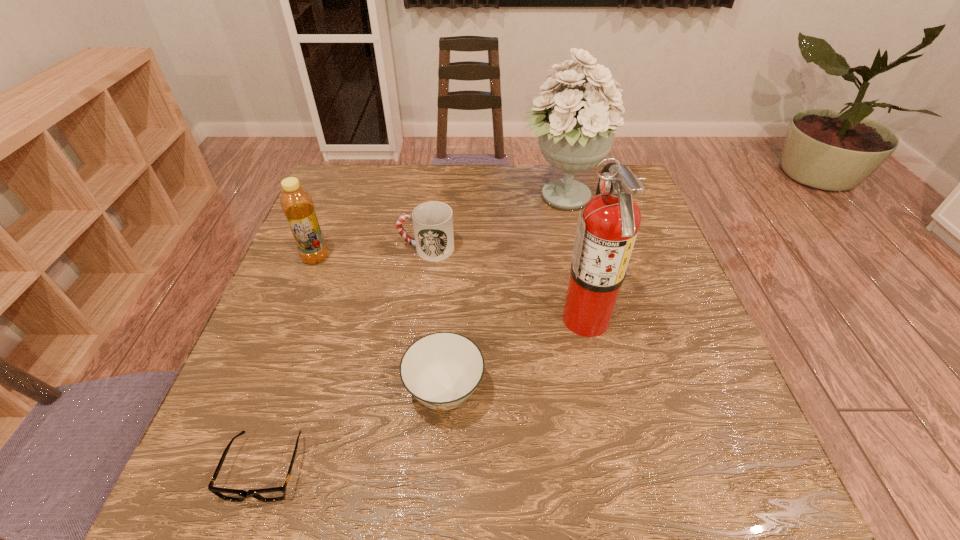
The image size is (960, 540). Identify the location of the farthest object. (575, 128).

Where is `the third nearest object`? the third nearest object is located at coordinates (606, 232).

Where is `bottle`? The width and height of the screenshot is (960, 540). bottle is located at coordinates (296, 202).

Identify the location of the fourth tallest object. The image size is (960, 540). (432, 221).

What are the coordinates of `the fifth tallest object` in the screenshot? It's located at [441, 370].

The width and height of the screenshot is (960, 540). Identify the location of soup bowl. (441, 370).

At what (x,y) coordinates should I click in order to perform the action: click on the shortest object. Please return your answer as a coordinate pair (x, y). This screenshot has width=960, height=540. Looking at the image, I should click on (273, 494).

Locate an element on the screen. the nearest object is located at coordinates (273, 494).

The width and height of the screenshot is (960, 540). In order to click on vacant region located on the front of the bouquet in this screenshot , I will do `click(595, 345)`.

You are a GUI agent. You are given a task and a screenshot of the screen. Output one action in this format:
    pyautogui.click(x=<x>, y=<y>)
    Task: Click on the vacant space located on the nozzle side of the fire extinguisher
    The image size is (960, 540).
    Given the screenshot: What is the action you would take?
    pyautogui.click(x=454, y=318)